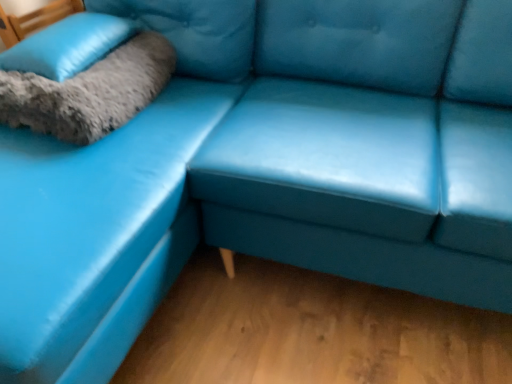
Question: Is matte blue leather couch at center next to gray fluffy pillow at upper left?

Choices:
 (A) yes
 (B) no

Answer: (B)

Question: Considering the relative sizes of matte blue leather couch at center and gray fluffy pillow at upper left in the image provided, is matte blue leather couch at center taller than gray fluffy pillow at upper left?

Choices:
 (A) yes
 (B) no

Answer: (A)

Question: Considering the relative sizes of matte blue leather couch at center and gray fluffy pillow at upper left in the image provided, is matte blue leather couch at center shorter than gray fluffy pillow at upper left?

Choices:
 (A) no
 (B) yes

Answer: (A)

Question: Is gray fluffy pillow at upper left completely or partially inside matte blue leather couch at center?

Choices:
 (A) yes
 (B) no

Answer: (A)

Question: From the image's perspective, would you say matte blue leather couch at center is shown under gray fluffy pillow at upper left?

Choices:
 (A) yes
 (B) no

Answer: (A)

Question: From a real-world perspective, is matte blue leather couch at center beneath gray fluffy pillow at upper left?

Choices:
 (A) no
 (B) yes

Answer: (B)

Question: Is soft gray fur pillow at upper left oriented away from gray fluffy pillow at upper left?

Choices:
 (A) yes
 (B) no

Answer: (B)

Question: Is soft gray fur pillow at upper left to the left of gray fluffy pillow at upper left from the viewer's perspective?

Choices:
 (A) yes
 (B) no

Answer: (A)

Question: Is soft gray fur pillow at upper left located outside gray fluffy pillow at upper left?

Choices:
 (A) yes
 (B) no

Answer: (A)

Question: Is soft gray fur pillow at upper left far from gray fluffy pillow at upper left?

Choices:
 (A) yes
 (B) no

Answer: (B)

Question: From the image's perspective, does soft gray fur pillow at upper left appear higher than gray fluffy pillow at upper left?

Choices:
 (A) yes
 (B) no

Answer: (A)

Question: Can you see soft gray fur pillow at upper left touching gray fluffy pillow at upper left?

Choices:
 (A) no
 (B) yes

Answer: (B)

Question: Can you see gray fluffy pillow at upper left touching soft gray fur pillow at upper left?

Choices:
 (A) yes
 (B) no

Answer: (A)